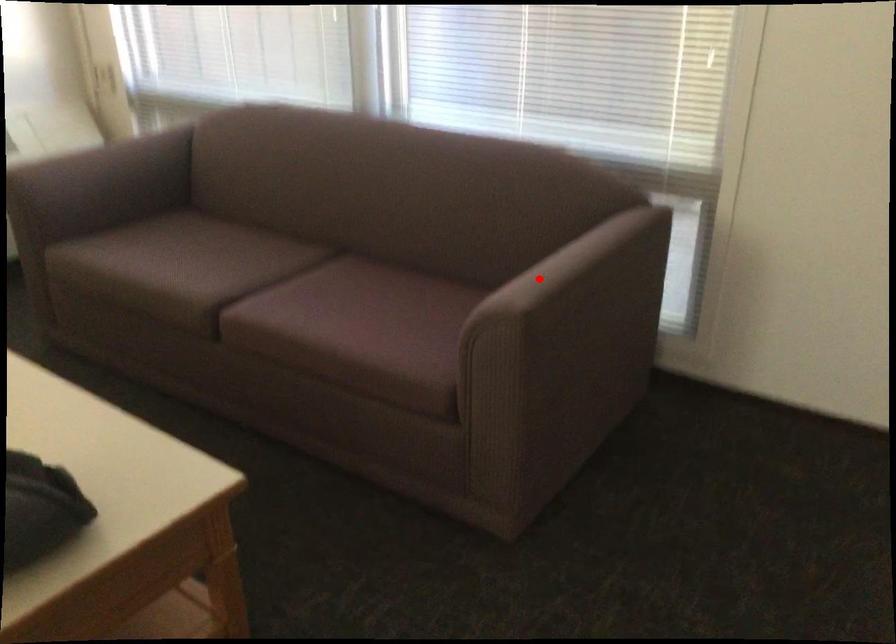
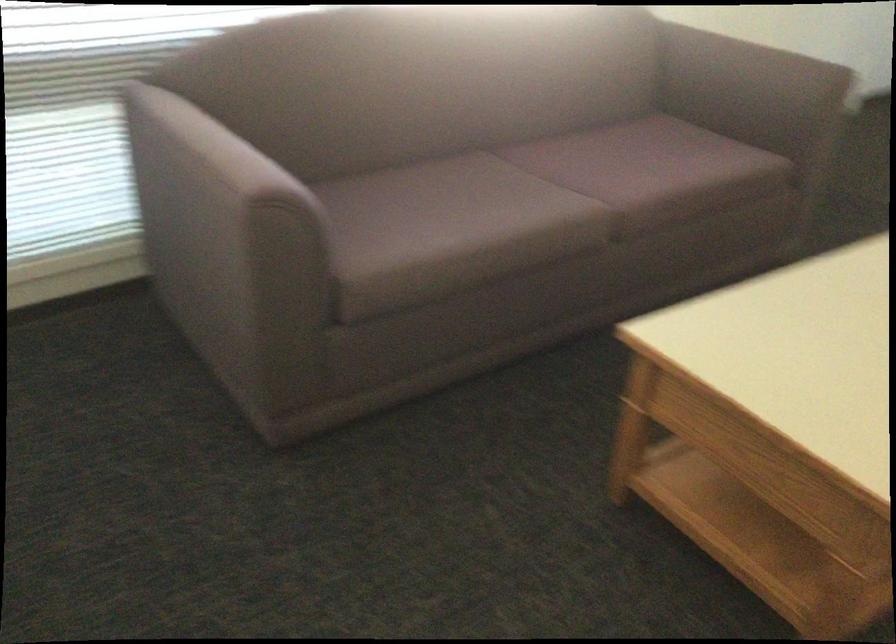
Question: I am providing you with two images of the same scene from different viewpoints. A red point is shown in image1. For the corresponding object point in image2, is it positioned nearer or farther from the camera?

Choices:
 (A) Nearer
 (B) Farther

Answer: (B)